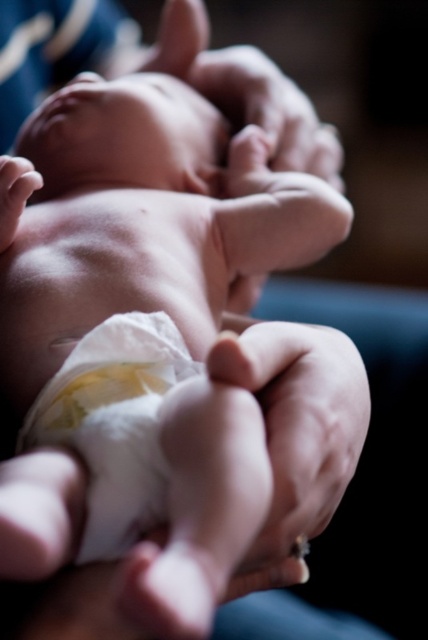
Which of these two, white soft diaper at center or smooth skin hand at lower left, stands taller?

With more height is white soft diaper at center.

Is point (98, 378) positioned before point (18, 161)?

Yes.

The height and width of the screenshot is (640, 428). Find the location of `white soft diaper at center`. white soft diaper at center is located at coordinates (115, 420).

Does smooth skin hand at center have a greater width compared to smooth skin hand at lower left?

Yes.

Is point (291, 150) positioned after point (9, 186)?

Yes.

Where is `smooth skin hand at center`? smooth skin hand at center is located at coordinates (269, 109).

You are a GUI agent. You are given a task and a screenshot of the screen. Output one action in this format:
    pyautogui.click(x=<x>, y=<y>)
    Task: Click on the smooth skin hand at center
    The height and width of the screenshot is (640, 428).
    Given the screenshot: What is the action you would take?
    pyautogui.click(x=269, y=109)

Is white soft diaper at center shorter than smooth skin hand at center?

Correct, white soft diaper at center is not as tall as smooth skin hand at center.

Between point (115, 461) and point (255, 90), which one is positioned in front?

Point (115, 461) is more forward.

Is point (65, 432) closer to viewer compared to point (324, 134)?

Yes, point (65, 432) is closer to viewer.

Image resolution: width=428 pixels, height=640 pixels. I want to click on white soft diaper at center, so click(115, 420).